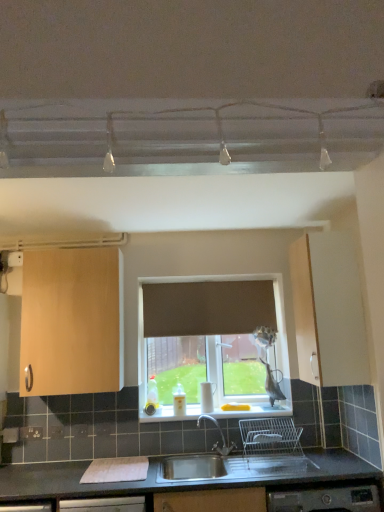
The width and height of the screenshot is (384, 512). In order to click on free point above white glossy window sill at center (from a real-world perspective) in this screenshot , I will do `click(214, 409)`.